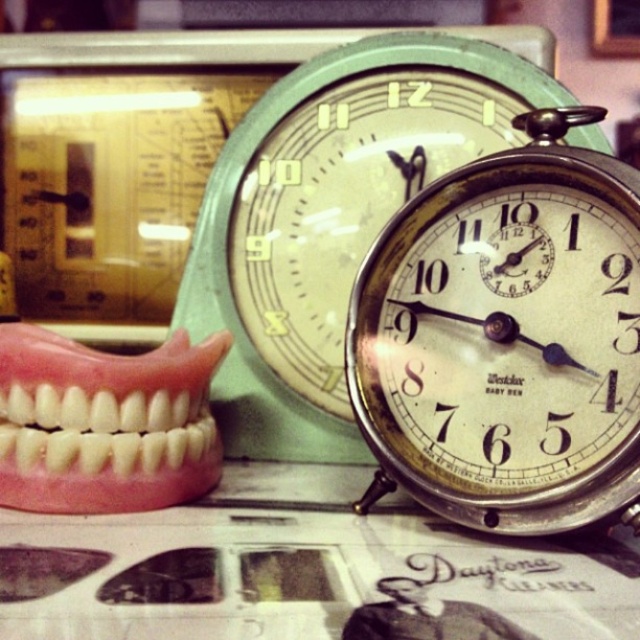
Question: Can you confirm if metallic silver alarm clock at center is positioned to the right of pink rubber denture at left?

Choices:
 (A) yes
 (B) no

Answer: (A)

Question: Which of the following is the closest to the observer?

Choices:
 (A) (465, 481)
 (B) (145, 472)

Answer: (A)

Question: Does metallic silver alarm clock at center appear under pink rubber denture at left?

Choices:
 (A) yes
 (B) no

Answer: (B)

Question: Which object appears closest to the camera in this image?

Choices:
 (A) metallic silver alarm clock at center
 (B) pink rubber denture at left

Answer: (A)

Question: Can you confirm if metallic silver alarm clock at center is wider than pink rubber denture at left?

Choices:
 (A) yes
 (B) no

Answer: (A)

Question: Which point is closer to the camera?

Choices:
 (A) (492, 308)
 (B) (60, 506)

Answer: (B)